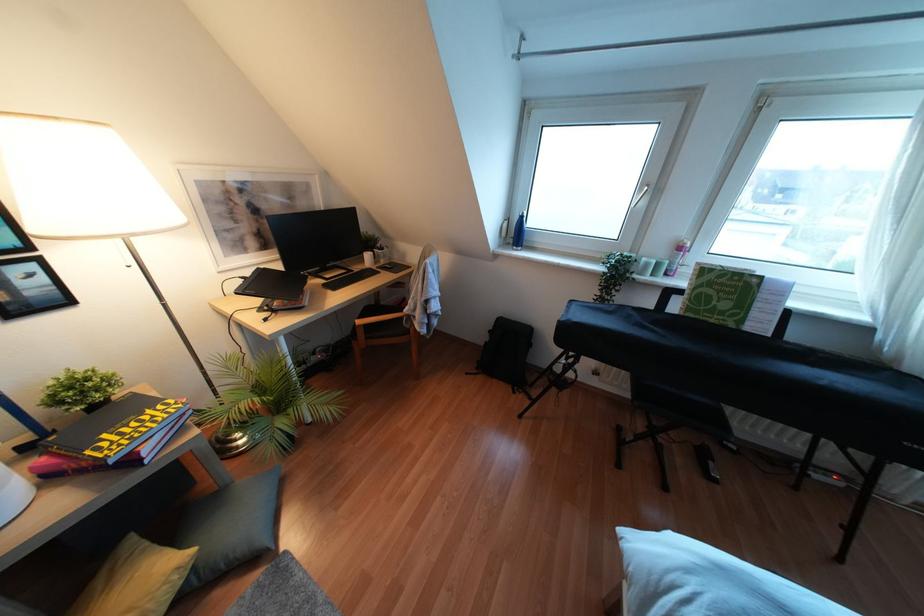
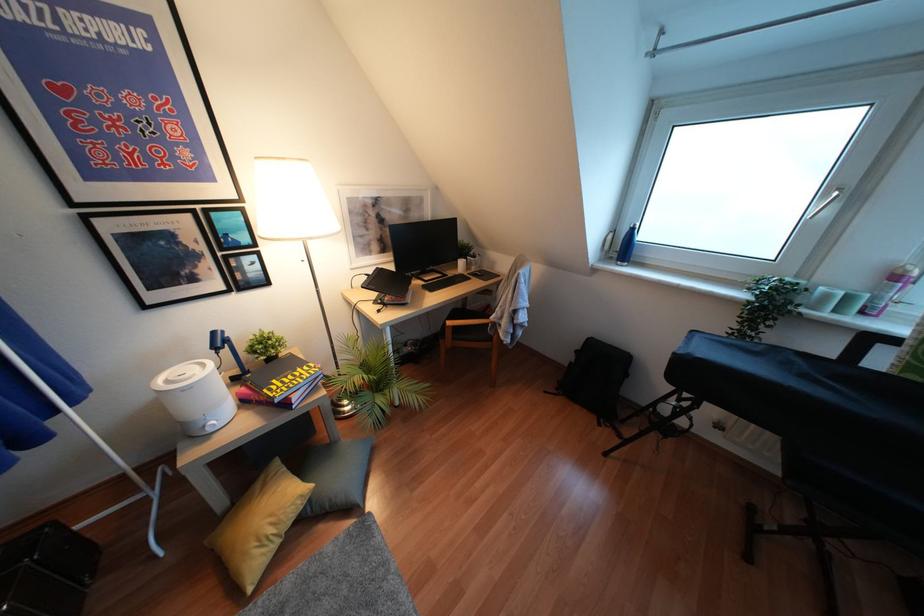
The point at (x=516, y=233) is marked in the first image. Where is the corresponding point in the second image?

(623, 246)